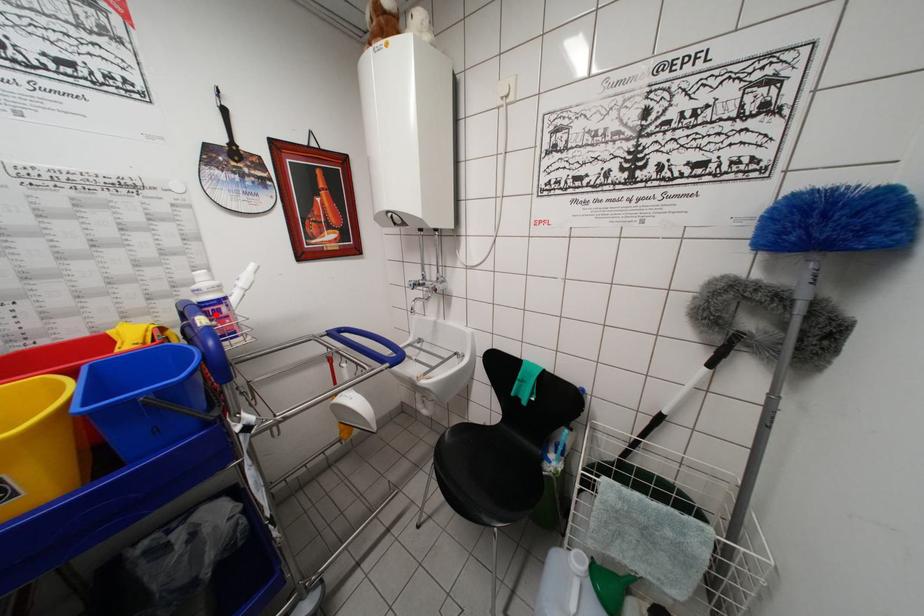
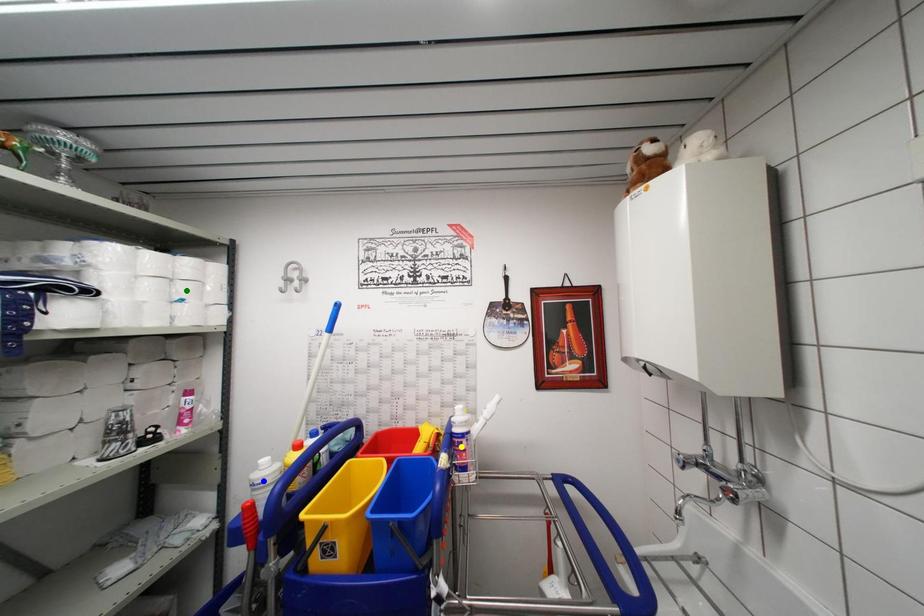
Question: I am providing you with two images of the same scene from different viewpoints. A red point is marked on the first image. You are given multiple points on the second image. Which mark in image 2 goes with the point in image 1?

Choices:
 (A) yellow point
 (B) green point
 (C) blue point

Answer: (A)